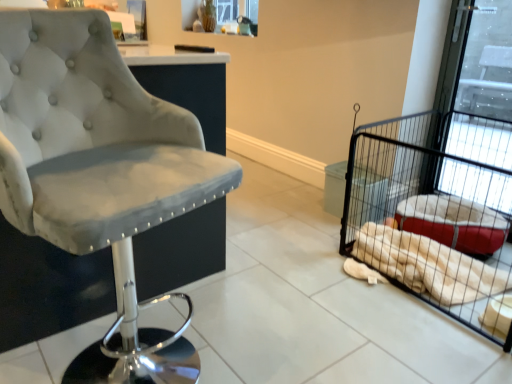
Image resolution: width=512 pixels, height=384 pixels. I want to click on spots to the right of velvet grey chair at left, so click(278, 330).